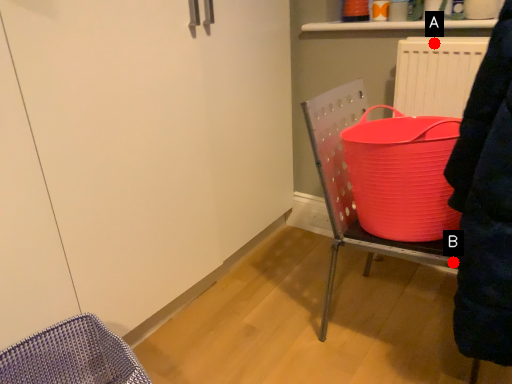
Question: Two points are circled on the image, labeled by A and B beside each circle. Which point appears farthest from the camera in this image?

Choices:
 (A) A is further
 (B) B is further

Answer: (A)